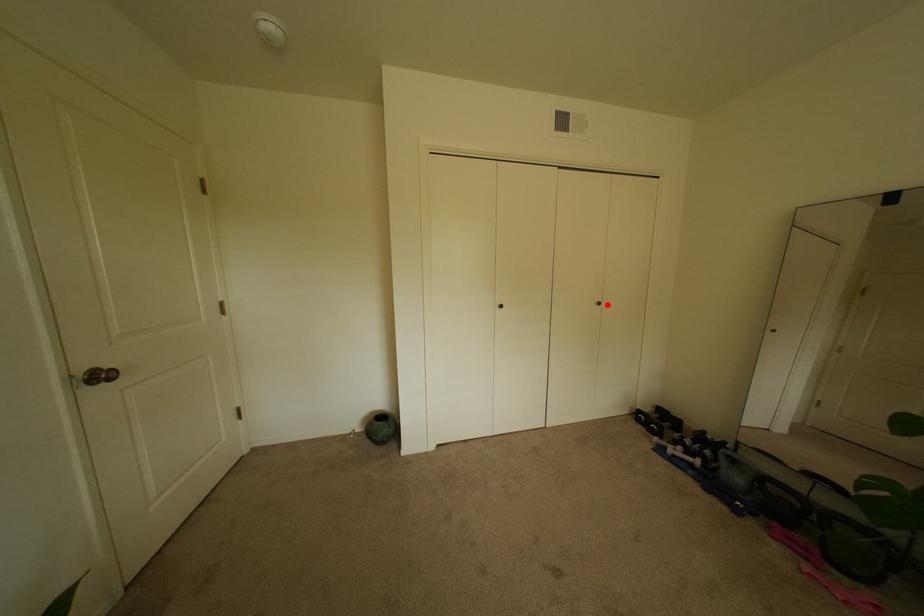
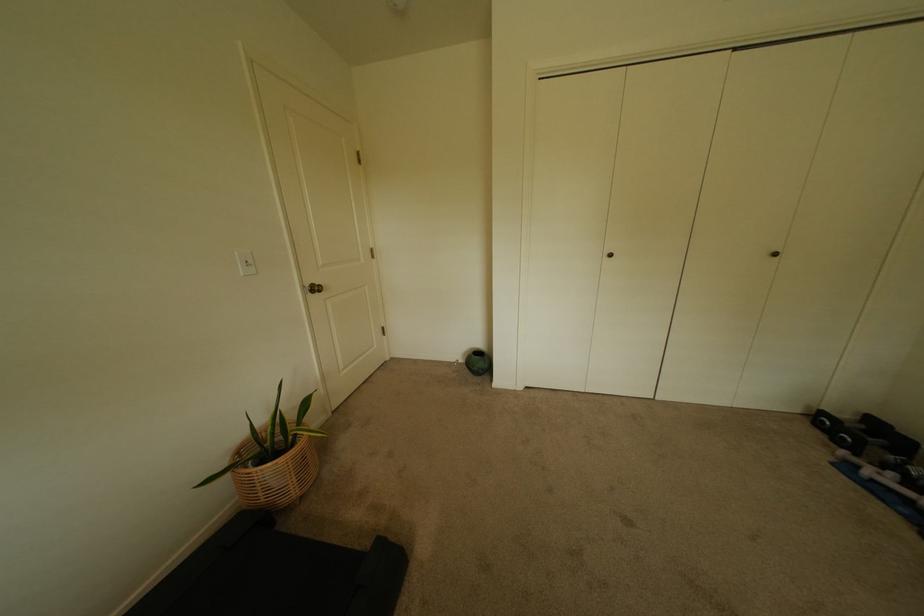
The point at the highlighted location is marked in the first image. Where is the corresponding point in the second image?

(784, 256)